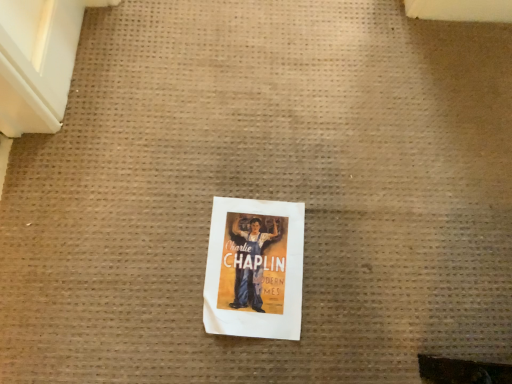
The height and width of the screenshot is (384, 512). Describe the element at coordinates (254, 269) in the screenshot. I see `matte paper poster at center` at that location.

Locate an element on the screen. The image size is (512, 384). matte paper poster at center is located at coordinates (254, 269).

The height and width of the screenshot is (384, 512). I want to click on matte paper poster at center, so click(x=254, y=269).